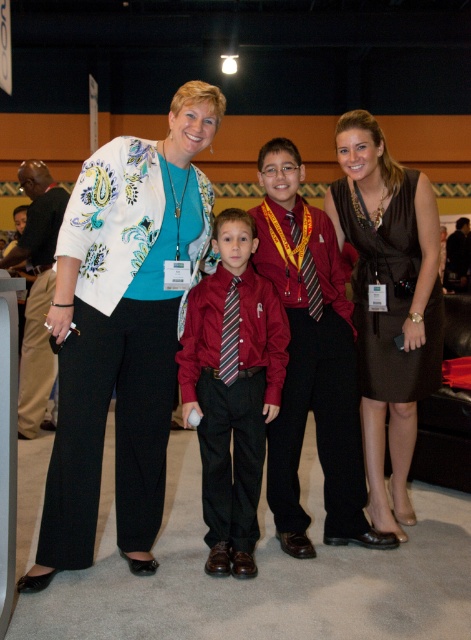
Question: Which object is closer to the camera taking this photo?

Choices:
 (A) brown satin dress at right
 (B) khaki pants at center

Answer: (A)

Question: Can you confirm if white floral blazer at center is thinner than matte red shirt at center?

Choices:
 (A) yes
 (B) no

Answer: (B)

Question: Which point is farther to the camera?

Choices:
 (A) matte red shirt at center
 (B) khaki pants at center
 (C) brown satin dress at right
 (D) white floral blazer at center

Answer: (B)

Question: Which point is farther to the camera?

Choices:
 (A) brown satin dress at right
 (B) white floral blazer at center
 (C) khaki pants at center
 (D) matte red shirt at center

Answer: (C)

Question: Does white floral blazer at center have a lesser width compared to khaki pants at center?

Choices:
 (A) no
 (B) yes

Answer: (A)

Question: Is white floral blazer at center above khaki pants at center?

Choices:
 (A) yes
 (B) no

Answer: (B)